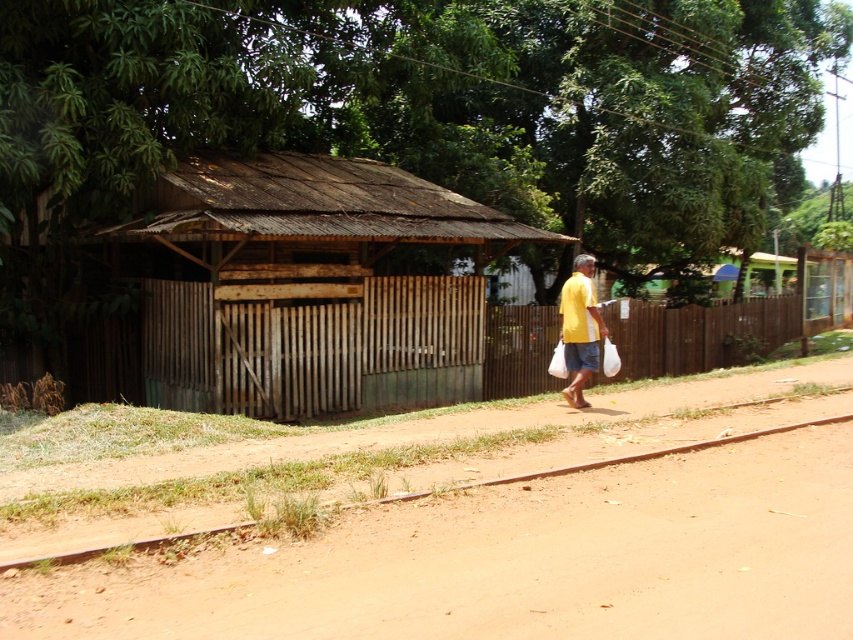
Is brown dirt track at lower left to the left of rusty corrugated hut at center from the viewer's perspective?

Yes, brown dirt track at lower left is to the left of rusty corrugated hut at center.

Is brown dirt track at lower left thinner than rusty corrugated hut at center?

Correct, brown dirt track at lower left's width is less than rusty corrugated hut at center's.

Where is `brown dirt track at lower left`? The height and width of the screenshot is (640, 853). brown dirt track at lower left is located at coordinates (509, 561).

This screenshot has height=640, width=853. In order to click on brown dirt track at lower left in this screenshot , I will do `click(509, 561)`.

Which is above, rusty corrugated hut at center or brown wooden fence at center?

Positioned higher is brown wooden fence at center.

How far apart are rusty corrugated hut at center and brown wooden fence at center?

rusty corrugated hut at center and brown wooden fence at center are 8.83 meters apart.

The height and width of the screenshot is (640, 853). I want to click on rusty corrugated hut at center, so click(305, 285).

Is the position of brown wooden fence at center more distant than that of yellow matte shirt at center?

Yes, brown wooden fence at center is further from the viewer.

Which is below, brown wooden fence at center or yellow matte shirt at center?

yellow matte shirt at center is lower down.

Measure the distance between brown wooden fence at center and camera.

They are 15.52 meters apart.

Find the location of a particular element. The image size is (853, 640). brown wooden fence at center is located at coordinates (697, 336).